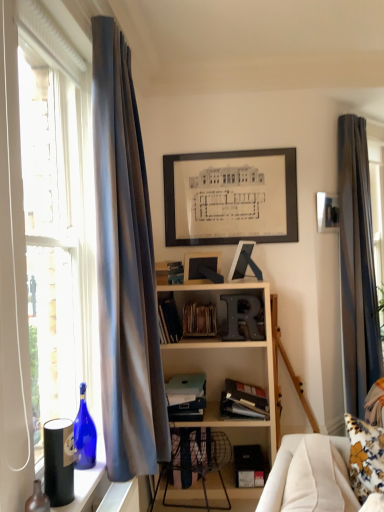
Question: Can you confirm if matte glass bottle at lower left, the 1th bottle positioned from the front, is thinner than silky blue curtain at right, which is the 2th curtain from front to back?

Choices:
 (A) yes
 (B) no

Answer: (A)

Question: Considering the relative sizes of matte glass bottle at lower left, the 1th bottle positioned from the front, and silky blue curtain at right, which is counted as the second curtain, starting from the left, in the image provided, is matte glass bottle at lower left, the 1th bottle positioned from the front, smaller than silky blue curtain at right, which is counted as the second curtain, starting from the left,?

Choices:
 (A) yes
 (B) no

Answer: (A)

Question: Is the position of matte glass bottle at lower left, the 1th bottle positioned from the front, less distant than that of silky blue curtain at right, acting as the 1th curtain starting from the right?

Choices:
 (A) no
 (B) yes

Answer: (B)

Question: Considering the relative sizes of matte glass bottle at lower left, which appears as the 2th bottle when viewed from the back, and silky blue curtain at right, which is counted as the second curtain, starting from the left, in the image provided, is matte glass bottle at lower left, which appears as the 2th bottle when viewed from the back, shorter than silky blue curtain at right, which is counted as the second curtain, starting from the left,?

Choices:
 (A) yes
 (B) no

Answer: (A)

Question: From a real-world perspective, is matte glass bottle at lower left, which appears as the 2th bottle when viewed from the back, positioned under silky blue curtain at right, acting as the first curtain starting from the back, based on gravity?

Choices:
 (A) no
 (B) yes

Answer: (B)

Question: In terms of size, does matte glass bottle at lower left, which appears as the 2th bottle when viewed from the back, appear bigger or smaller than wooden spines at center, which ranks as the second book in top-to-bottom order?

Choices:
 (A) big
 (B) small

Answer: (B)

Question: Choose the correct answer: Is matte glass bottle at lower left, the 1th bottle positioned from the front, inside wooden spines at center, placed as the 4th book when sorted from bottom to top, or outside it?

Choices:
 (A) inside
 (B) outside

Answer: (B)

Question: From a real-world perspective, is matte glass bottle at lower left, the 1th bottle positioned from the front, physically located above or below wooden spines at center, placed as the 4th book when sorted from bottom to top?

Choices:
 (A) below
 (B) above

Answer: (A)

Question: Considering the positions of matte glass bottle at lower left, the 1th bottle positioned from the front, and wooden spines at center, placed as the 4th book when sorted from bottom to top, in the image, is matte glass bottle at lower left, the 1th bottle positioned from the front, wider or thinner than wooden spines at center, placed as the 4th book when sorted from bottom to top,?

Choices:
 (A) thin
 (B) wide

Answer: (A)

Question: Is point (183, 267) closer or farther from the camera than point (185, 314)?

Choices:
 (A) farther
 (B) closer

Answer: (A)

Question: From the image's perspective, is matte blue book at center, the 1th book from the top, above or below wooden spines at center, which ranks as the second book in top-to-bottom order?

Choices:
 (A) below
 (B) above

Answer: (B)

Question: Choose the correct answer: Is matte blue book at center, the 5th book ordered from the bottom, inside wooden spines at center, placed as the 4th book when sorted from bottom to top, or outside it?

Choices:
 (A) outside
 (B) inside

Answer: (A)

Question: From a real-world perspective, relative to wooden spines at center, which ranks as the second book in top-to-bottom order, is matte blue book at center, the 5th book ordered from the bottom, vertically above or below?

Choices:
 (A) below
 (B) above

Answer: (B)

Question: Based on their sizes in the image, would you say matte blue book at center, the 1th book from the top, is bigger or smaller than hardcover book at center, the 2th book from the bottom?

Choices:
 (A) big
 (B) small

Answer: (B)

Question: Relative to hardcover book at center, the 2th book from the bottom, is matte blue book at center, the 5th book ordered from the bottom, in front or behind?

Choices:
 (A) front
 (B) behind

Answer: (B)